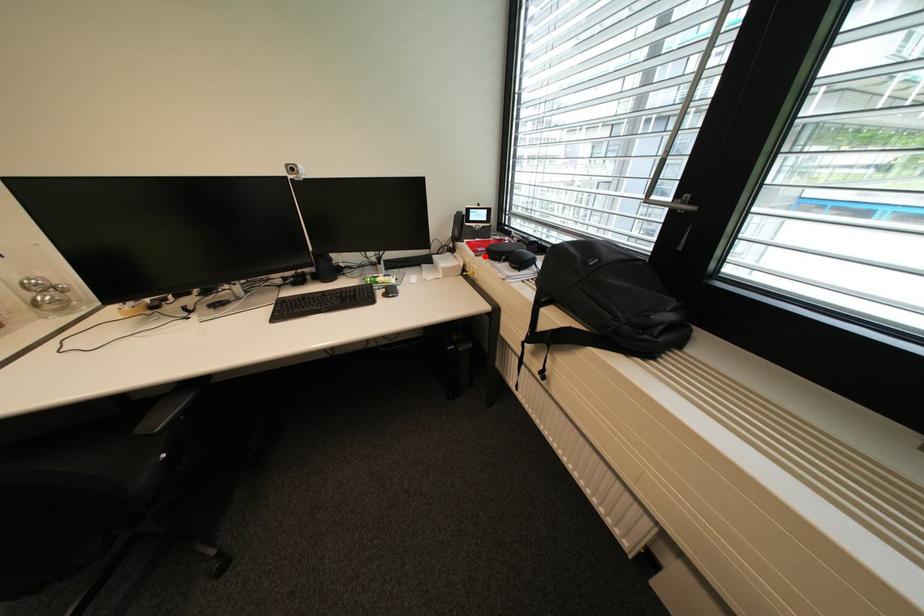
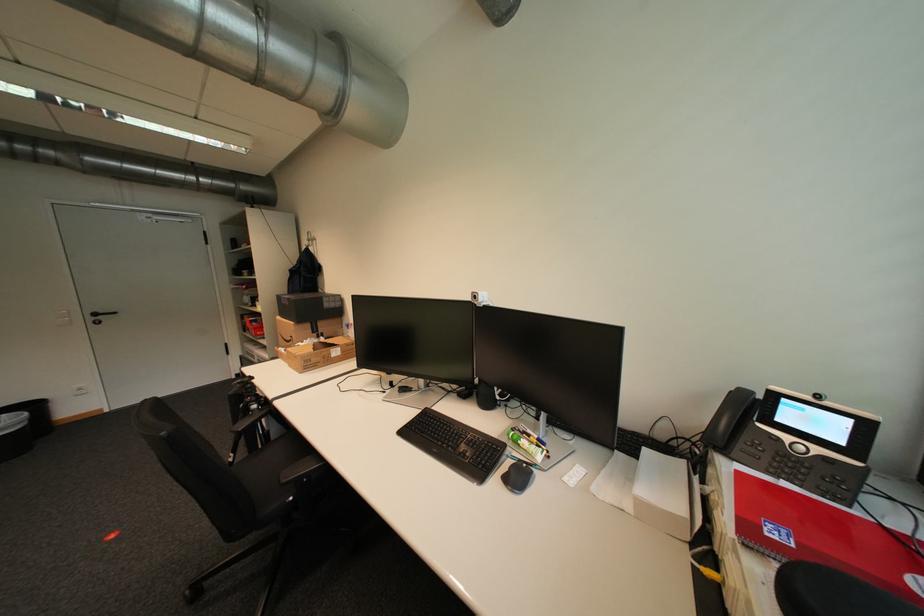
Question: I am providing you with two images of the same scene from different viewpoints. Given a red point in image1, look at the same physical point in image2. Is it:

Choices:
 (A) Closer to the viewpoint
 (B) Farther from the viewpoint

Answer: (B)